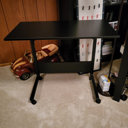
Locate an element on the screen. Image resolution: width=128 pixels, height=128 pixels. casters is located at coordinates (41, 78), (33, 103), (96, 100), (89, 78).